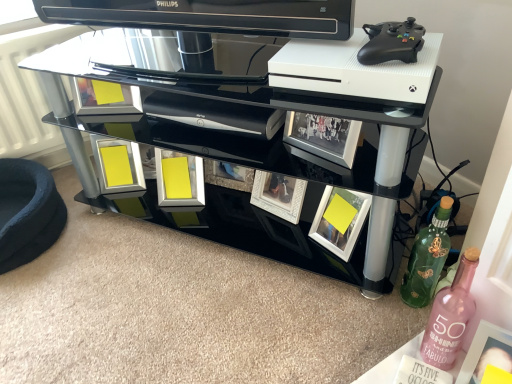
Find the location of a particular element. The height and width of the screenshot is (384, 512). vacant space that is to the left of white glossy magazine at lower right is located at coordinates (336, 357).